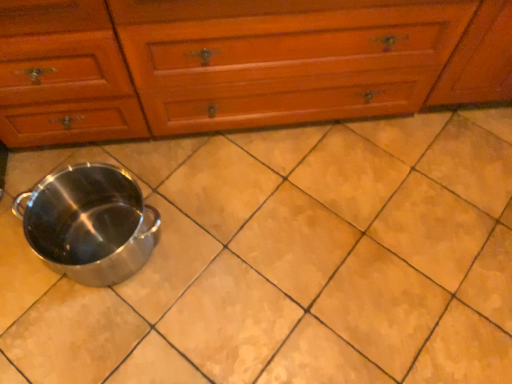
Find the location of a particular element. The image size is (512, 384). free point above matte ceramic tile at center (from a real-world perspective) is located at coordinates (296, 238).